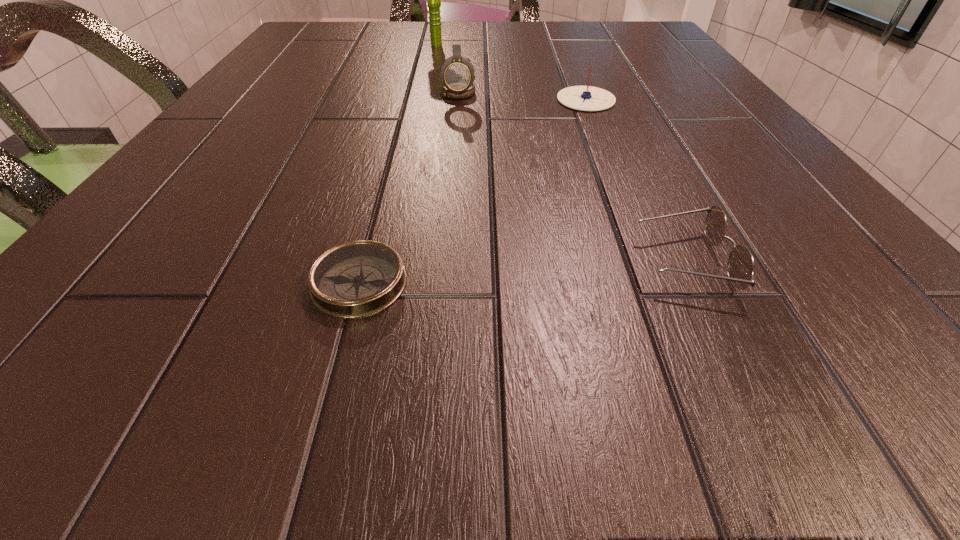
Find the location of a particular element. This screenshot has height=540, width=960. vacant region located on the face of the tallest compass is located at coordinates (454, 152).

The height and width of the screenshot is (540, 960). I want to click on free region located 0.260m on the back of the second tallest compass, so click(564, 43).

Find the location of `vacant position located 0.320m on the front-facing side of the spectacles`. vacant position located 0.320m on the front-facing side of the spectacles is located at coordinates (364, 261).

The image size is (960, 540). I want to click on free region located on the front-facing side of the spectacles, so click(x=556, y=261).

The width and height of the screenshot is (960, 540). I want to click on vacant space situated 0.280m on the front-facing side of the spectacles, so click(398, 261).

The width and height of the screenshot is (960, 540). I want to click on free space located 0.210m on the left of the nearest compass, so click(x=120, y=283).

Identify the location of object positioned at the far edge. [x=433, y=0].

Locate an element on the screen. object located at the near edge is located at coordinates (357, 279).

I want to click on vacant area at the far edge of the desktop, so click(524, 34).

Image resolution: width=960 pixels, height=540 pixels. Find the location of `free space at the near edge of the desktop`. free space at the near edge of the desktop is located at coordinates (589, 329).